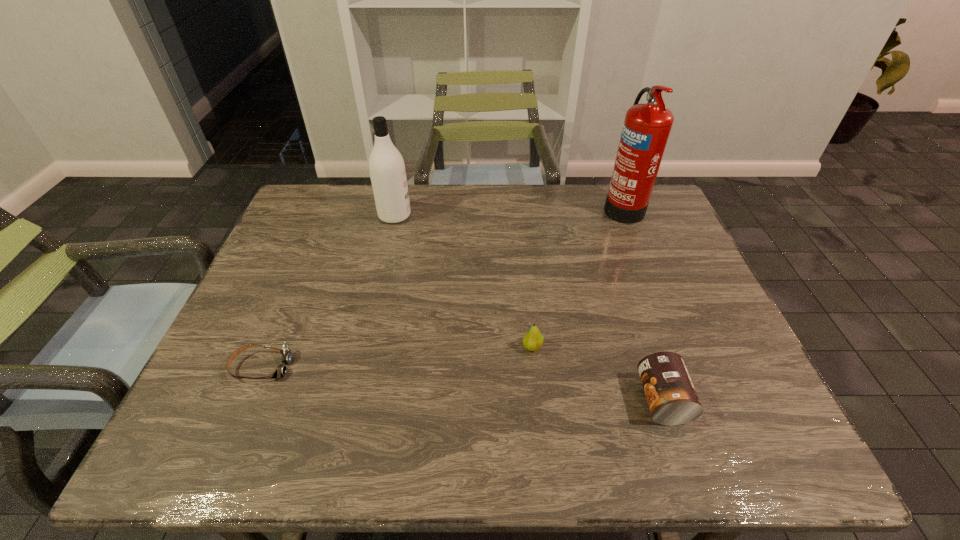
Where is `free spot that satisfies the following two spatial constraints: 1. on the front-facing side of the third object from left to right; 2. on the right side of the fourth shortest object`? free spot that satisfies the following two spatial constraints: 1. on the front-facing side of the third object from left to right; 2. on the right side of the fourth shortest object is located at coordinates (364, 347).